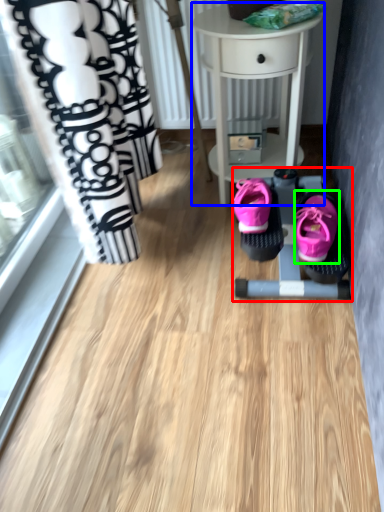
Question: Which object is the closest to the baby carriage (highlighted by a red box)? Choose among these: table (highlighted by a blue box) or footwear (highlighted by a green box).

Choices:
 (A) table
 (B) footwear

Answer: (B)